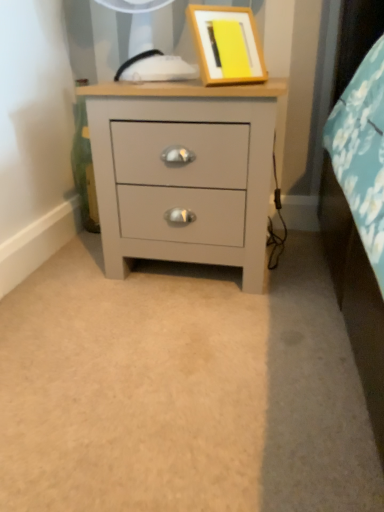
Question: Is matte gray chest of drawers at center inside the boundaries of wooden picture frame at upper center, or outside?

Choices:
 (A) inside
 (B) outside

Answer: (B)

Question: Considering the positions of point (167, 124) and point (203, 45), is point (167, 124) closer or farther from the camera than point (203, 45)?

Choices:
 (A) closer
 (B) farther

Answer: (B)

Question: Is matte gray chest of drawers at center wider or thinner than wooden picture frame at upper center?

Choices:
 (A) wide
 (B) thin

Answer: (A)

Question: Which is correct: wooden picture frame at upper center is inside matte gray chest of drawers at center, or outside of it?

Choices:
 (A) outside
 (B) inside

Answer: (A)

Question: From the image's perspective, is wooden picture frame at upper center above or below matte gray chest of drawers at center?

Choices:
 (A) above
 (B) below

Answer: (A)

Question: From their relative heights in the image, would you say wooden picture frame at upper center is taller or shorter than matte gray chest of drawers at center?

Choices:
 (A) short
 (B) tall

Answer: (A)

Question: Looking at their shapes, would you say wooden picture frame at upper center is wider or thinner than matte gray chest of drawers at center?

Choices:
 (A) wide
 (B) thin

Answer: (B)